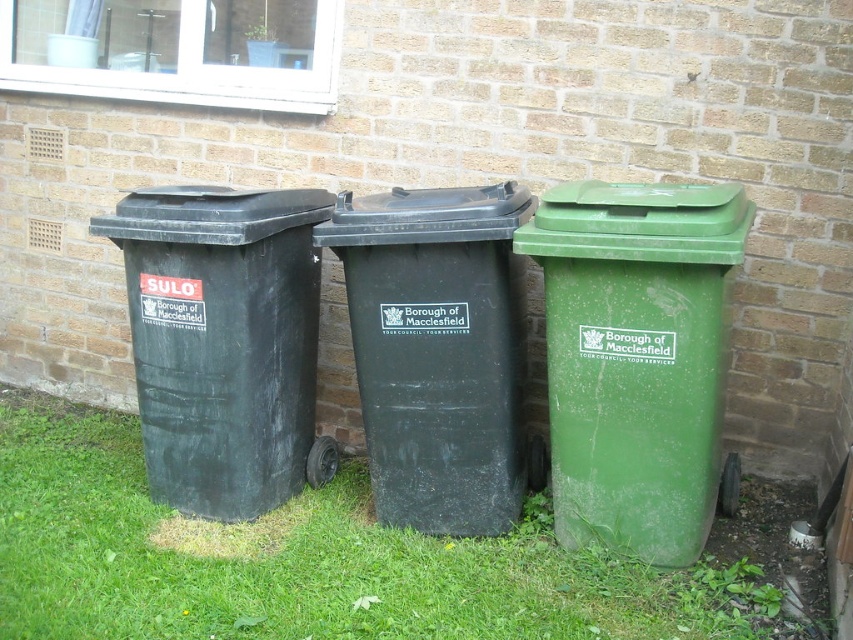
You are standing in front of the three wheeled bins. There are two points marked on the bins. One is at point coordinates (640, 216) and the other is at (498, 516). Which point is closer to you?

Point (640, 216) is closer to you than point (498, 516).

You are standing in front of the three bins against the brick wall. You need to find the matte black bin at left. According to the 2D coordinates provided, where exactly is it located?

The matte black bin at left is located at the 2D coordinates point [223,340].

You are a waste collector driving a truck that needs to access the green plastic recycling bin at right and the black plastic bin at center. According to the scene description, which bin should you move first to ensure proper access?

The green plastic recycling bin at right is positioned under the black plastic bin at center, so you should move the black plastic bin at center first to access the green plastic recycling bin at right.